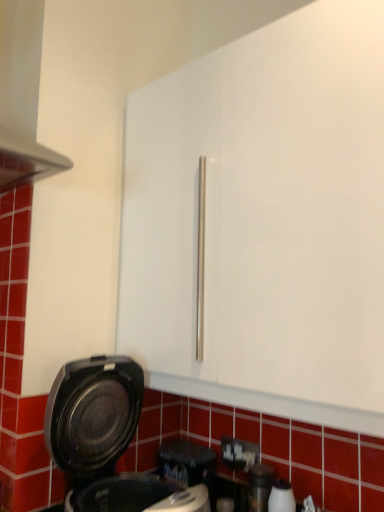
In order to face white plastic electric outlet at lower center, should I rotate leftwards or rightwards?

Rotate your view right by about 6.641°.

What do you see at coordinates (239, 453) in the screenshot? The image size is (384, 512). I see `white plastic electric outlet at lower center` at bounding box center [239, 453].

This screenshot has height=512, width=384. I want to click on white plastic electric outlet at lower center, so click(x=239, y=453).

You are a GUI agent. You are given a task and a screenshot of the screen. Output one action in this format:
    pyautogui.click(x=<x>, y=<y>)
    Task: Click on the white plastic electric outlet at lower center
    This screenshot has width=384, height=512.
    Given the screenshot: What is the action you would take?
    pyautogui.click(x=239, y=453)